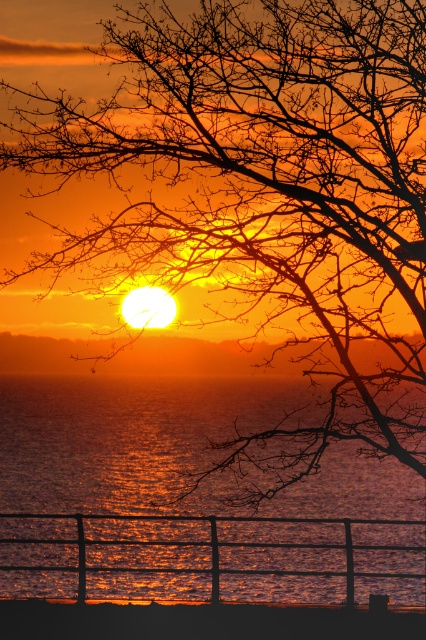
You are an artist planning to paint the sunset scene. You want to ensure the glistening water at lower center and the orange matte horizon at center are proportionally accurate. Based on the scene, which of these two objects should you paint to be bigger?

The glistening water at lower center should be painted bigger since it has a larger size compared to the orange matte horizon at center according to the description.

You are standing on the shore of the lake and see two points in the image. The first point is at coordinates point (x=184, y=548) and the second is at point (x=259, y=342). Which point is closer to you?

The point at coordinates point (x=184, y=548) is closer to you than the point at point (x=259, y=342).

From the picture: You are standing at the center of the image and want to walk towards the glistening water at lower center. Based on its position coordinates, which direction should you move?

The glistening water at lower center is located at point 0.780 on the x axis and 0.437 on the y axis. Since you are at the center, you should move towards the right and slightly downward to reach it.